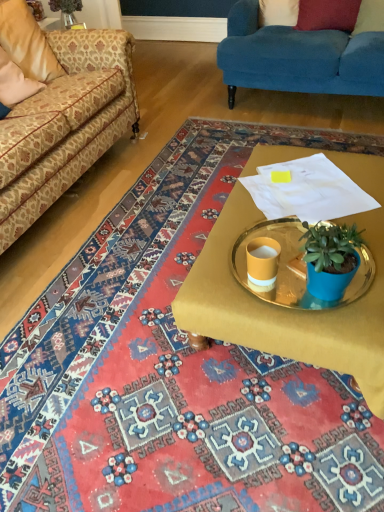
What do you see at coordinates (27, 42) in the screenshot? I see `beige fabric pillow at upper left, which is the 1th pillow in left-to-right order` at bounding box center [27, 42].

Describe the element at coordinates (295, 268) in the screenshot. I see `gold metallic tray at center` at that location.

How much space does red velvet pillow at upper right, the 3th pillow when ordered from left to right, occupy vertically?

red velvet pillow at upper right, the 3th pillow when ordered from left to right, is 10.13 inches tall.

Describe the element at coordinates (327, 15) in the screenshot. I see `red velvet pillow at upper right, the 3th pillow when ordered from left to right` at that location.

The image size is (384, 512). What do you see at coordinates (65, 124) in the screenshot?
I see `patterned fabric couch at left, which ranks as the second studio couch in right-to-left order` at bounding box center [65, 124].

Locate an element on the screen. velvet blue couch at upper right, which appears as the 1th studio couch when viewed from the right is located at coordinates (298, 57).

Considering the sizes of matte yellow cup at center and velvet red pillow at upper right, which is counted as the first pillow, starting from the right, in the image, is matte yellow cup at center wider or thinner than velvet red pillow at upper right, which is counted as the first pillow, starting from the right,?

Clearly, matte yellow cup at center has less width compared to velvet red pillow at upper right, which is counted as the first pillow, starting from the right.

Does matte yellow cup at center have a smaller size compared to velvet red pillow at upper right, positioned as the 4th pillow in left-to-right order?

Yes, matte yellow cup at center is smaller than velvet red pillow at upper right, positioned as the 4th pillow in left-to-right order.

What's the angular difference between matte yellow cup at center and velvet red pillow at upper right, which is counted as the first pillow, starting from the right,'s facing directions?

There is a 105-degree angle between the facing directions of matte yellow cup at center and velvet red pillow at upper right, which is counted as the first pillow, starting from the right.

Is matte yellow cup at center to the left of velvet red pillow at upper right, which is counted as the first pillow, starting from the right, from the viewer's perspective?

Correct, you'll find matte yellow cup at center to the left of velvet red pillow at upper right, which is counted as the first pillow, starting from the right.

Can you confirm if gold metallic tray at center is smaller than matte yellow cup at center?

Actually, gold metallic tray at center might be larger than matte yellow cup at center.

From a real-world perspective, does gold metallic tray at center stand above matte yellow cup at center?

No.

From the image's perspective, relative to matte yellow cup at center, is gold metallic tray at center above or below?

Based on their image positions, gold metallic tray at center is located above matte yellow cup at center.

Can you confirm if gold metallic tray at center is shorter than matte yellow cup at center?

Indeed, gold metallic tray at center has a lesser height compared to matte yellow cup at center.

Can you confirm if white fabric pillow at upper center, marked as the 2th pillow in a left-to-right arrangement, is wider than velvet red pillow at upper right, positioned as the 4th pillow in left-to-right order?

In fact, white fabric pillow at upper center, marked as the 2th pillow in a left-to-right arrangement, might be narrower than velvet red pillow at upper right, positioned as the 4th pillow in left-to-right order.

Consider the image. How many degrees apart are the facing directions of white fabric pillow at upper center, positioned as the third pillow in right-to-left order, and velvet red pillow at upper right, which is counted as the first pillow, starting from the right?

The facing directions of white fabric pillow at upper center, positioned as the third pillow in right-to-left order, and velvet red pillow at upper right, which is counted as the first pillow, starting from the right, are 25.2 degrees apart.

Is white fabric pillow at upper center, positioned as the third pillow in right-to-left order, aimed at velvet red pillow at upper right, positioned as the 4th pillow in left-to-right order?

No, white fabric pillow at upper center, positioned as the third pillow in right-to-left order, does not turn towards velvet red pillow at upper right, positioned as the 4th pillow in left-to-right order.

Which of these two, beige fabric pillow at upper left, which is counted as the fourth pillow, starting from the right, or gold metallic tray at center, is bigger?

gold metallic tray at center is bigger.

From the image's perspective, is beige fabric pillow at upper left, which is the 1th pillow in left-to-right order, beneath gold metallic tray at center?

No, from the image's perspective, beige fabric pillow at upper left, which is the 1th pillow in left-to-right order, is not beneath gold metallic tray at center.

Image resolution: width=384 pixels, height=512 pixels. Identify the location of desk in front of the beige fabric pillow at upper left, which is counted as the fourth pillow, starting from the right. (291, 309).

Who is taller, beige fabric pillow at upper left, which is the 1th pillow in left-to-right order, or gold metallic tray at center?

beige fabric pillow at upper left, which is the 1th pillow in left-to-right order.

Can you confirm if white fabric pillow at upper center, positioned as the third pillow in right-to-left order, is taller than velvet blue couch at upper right, which appears as the 1th studio couch when viewed from the right?

In fact, white fabric pillow at upper center, positioned as the third pillow in right-to-left order, may be shorter than velvet blue couch at upper right, which appears as the 1th studio couch when viewed from the right.

From the image's perspective, which one is positioned lower, white fabric pillow at upper center, positioned as the third pillow in right-to-left order, or velvet blue couch at upper right, which appears as the 2th studio couch when viewed from the left?

From the image's view, velvet blue couch at upper right, which appears as the 2th studio couch when viewed from the left, is below.

Which is correct: white fabric pillow at upper center, marked as the 2th pillow in a left-to-right arrangement, is inside velvet blue couch at upper right, which appears as the 1th studio couch when viewed from the right, or outside of it?

white fabric pillow at upper center, marked as the 2th pillow in a left-to-right arrangement, exists entirely within velvet blue couch at upper right, which appears as the 1th studio couch when viewed from the right.

How far apart are white fabric pillow at upper center, positioned as the third pillow in right-to-left order, and velvet blue couch at upper right, which appears as the 2th studio couch when viewed from the left?

They are 18.86 inches apart.

Which of these two, beige fabric pillow at upper left, which is counted as the fourth pillow, starting from the right, or matte yellow cup at center, is bigger?

beige fabric pillow at upper left, which is counted as the fourth pillow, starting from the right, is bigger.

Locate an element on the screen. the 1st pillow above the matte yellow cup at center (from the image's perspective) is located at coordinates (x=27, y=42).

Is beige fabric pillow at upper left, which is counted as the fourth pillow, starting from the right, not close to matte yellow cup at center?

beige fabric pillow at upper left, which is counted as the fourth pillow, starting from the right, is far away from matte yellow cup at center.

In the scene shown: Which is nearer, [5,15] or [269,277]?

Point [5,15] appears to be farther away from the viewer than point [269,277].

In the image, is red velvet pillow at upper right, placed as the 2th pillow when sorted from right to left, positioned in front of or behind beige fabric pillow at upper left, which is the 1th pillow in left-to-right order?

Visually, red velvet pillow at upper right, placed as the 2th pillow when sorted from right to left, is located behind beige fabric pillow at upper left, which is the 1th pillow in left-to-right order.

Is red velvet pillow at upper right, the 3th pillow when ordered from left to right, shorter than beige fabric pillow at upper left, which is counted as the fourth pillow, starting from the right?

Yes, red velvet pillow at upper right, the 3th pillow when ordered from left to right, is shorter than beige fabric pillow at upper left, which is counted as the fourth pillow, starting from the right.

From a real-world perspective, is red velvet pillow at upper right, placed as the 2th pillow when sorted from right to left, physically located above or below beige fabric pillow at upper left, which is counted as the fourth pillow, starting from the right?

From a real-world perspective, red velvet pillow at upper right, placed as the 2th pillow when sorted from right to left, is physically below beige fabric pillow at upper left, which is counted as the fourth pillow, starting from the right.

The height and width of the screenshot is (512, 384). I want to click on coffee cup located in front of the velvet red pillow at upper right, positioned as the 4th pillow in left-to-right order, so click(x=262, y=262).

I want to click on coffee cup that is above the gold metallic tray at center (from a real-world perspective), so click(262, 262).

In the scene shown: Looking at the image, which one is located further to velvet blue couch at upper right, which appears as the 2th studio couch when viewed from the left, matte yellow cup at center or velvet red pillow at upper right, which is counted as the first pillow, starting from the right?

matte yellow cup at center lies further to velvet blue couch at upper right, which appears as the 2th studio couch when viewed from the left, than the other object.

Which object lies further to the anchor point patterned fabric couch at left, marked as the first studio couch in a left-to-right arrangement, velvet red pillow at upper right, which is counted as the first pillow, starting from the right, or white fabric pillow at upper center, marked as the 2th pillow in a left-to-right arrangement?

Based on the image, velvet red pillow at upper right, which is counted as the first pillow, starting from the right, appears to be further to patterned fabric couch at left, marked as the first studio couch in a left-to-right arrangement.

Considering their positions, is velvet blue couch at upper right, which appears as the 1th studio couch when viewed from the right, positioned further to white fabric pillow at upper center, positioned as the third pillow in right-to-left order, than gold metallic tray at center?

gold metallic tray at center is further to white fabric pillow at upper center, positioned as the third pillow in right-to-left order.

Which object lies further to the anchor point white fabric pillow at upper center, positioned as the third pillow in right-to-left order, gold metallic tray at center or patterned fabric couch at left, which ranks as the second studio couch in right-to-left order?

gold metallic tray at center.

Based on their spatial positions, is beige fabric pillow at upper left, which is counted as the fourth pillow, starting from the right, or gold metallic tray at center closer to velvet red pillow at upper right, positioned as the 4th pillow in left-to-right order?

Based on the image, beige fabric pillow at upper left, which is counted as the fourth pillow, starting from the right, appears to be nearer to velvet red pillow at upper right, positioned as the 4th pillow in left-to-right order.

Estimate the real-world distances between objects in this image. Which object is closer to patterned fabric couch at left, marked as the first studio couch in a left-to-right arrangement, red velvet pillow at upper right, placed as the 2th pillow when sorted from right to left, or gold metallic tray at center?

Among the two, gold metallic tray at center is located nearer to patterned fabric couch at left, marked as the first studio couch in a left-to-right arrangement.

When comparing their distances from patterned fabric couch at left, which ranks as the second studio couch in right-to-left order, does beige fabric pillow at upper left, which is the 1th pillow in left-to-right order, or matte yellow cup at center seem further?

Among the two, matte yellow cup at center is located further to patterned fabric couch at left, which ranks as the second studio couch in right-to-left order.

Based on their spatial positions, is velvet blue couch at upper right, which appears as the 2th studio couch when viewed from the left, or white fabric pillow at upper center, positioned as the third pillow in right-to-left order, closer to gold metallic tray at center?

Based on the image, velvet blue couch at upper right, which appears as the 2th studio couch when viewed from the left, appears to be nearer to gold metallic tray at center.

You are a GUI agent. You are given a task and a screenshot of the screen. Output one action in this format:
    pyautogui.click(x=<x>, y=<y>)
    Task: Click on the pillow between beige fabric pillow at upper left, which is the 1th pillow in left-to-right order, and red velvet pillow at upper right, the 3th pillow when ordered from left to right
    The width and height of the screenshot is (384, 512).
    Given the screenshot: What is the action you would take?
    pyautogui.click(x=278, y=12)

Locate an element on the screen. round table between white fabric pillow at upper center, positioned as the third pillow in right-to-left order, and matte yellow cup at center from top to bottom is located at coordinates (295, 268).

The height and width of the screenshot is (512, 384). I want to click on coffee cup located between gold metallic tray at center and white fabric pillow at upper center, marked as the 2th pillow in a left-to-right arrangement, in the depth direction, so click(x=262, y=262).

You are a GUI agent. You are given a task and a screenshot of the screen. Output one action in this format:
    pyautogui.click(x=<x>, y=<y>)
    Task: Click on the round table between beige fabric pillow at upper left, which is the 1th pillow in left-to-right order, and velvet red pillow at upper right, positioned as the 4th pillow in left-to-right order, from left to right
    The height and width of the screenshot is (512, 384).
    Given the screenshot: What is the action you would take?
    pyautogui.click(x=295, y=268)